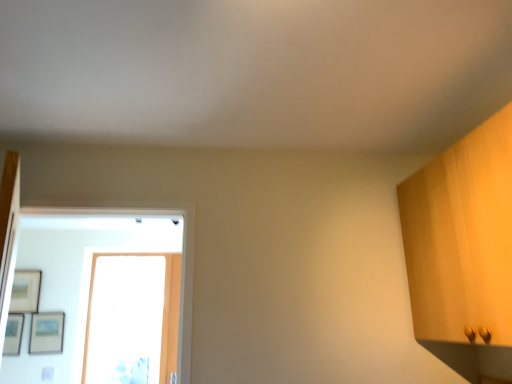
The height and width of the screenshot is (384, 512). What do you see at coordinates (25, 291) in the screenshot?
I see `matte wooden picture frame at upper left, arranged as the 1th picture frame when viewed from the left` at bounding box center [25, 291].

Image resolution: width=512 pixels, height=384 pixels. What are the coordinates of `transparent glass door at center` in the screenshot? It's located at (132, 319).

Where is `matte wooden picture frame at upper left, arranged as the 1th picture frame when viewed from the left`? This screenshot has height=384, width=512. matte wooden picture frame at upper left, arranged as the 1th picture frame when viewed from the left is located at coordinates (25, 291).

Between matte black picture frame at lower left, the first picture frame when ordered from right to left, and matte black picture frame at left, which is counted as the 2th picture frame, starting from the right, which one has more height?

Standing taller between the two is matte black picture frame at lower left, the first picture frame when ordered from right to left.

Consider the image. Is matte black picture frame at lower left, the first picture frame when ordered from right to left, aimed at matte black picture frame at left, which is counted as the 2th picture frame, starting from the right?

No, matte black picture frame at lower left, the first picture frame when ordered from right to left, does not turn towards matte black picture frame at left, which is counted as the 2th picture frame, starting from the right.

Considering the sizes of objects matte black picture frame at lower left, the first picture frame when ordered from right to left, and matte black picture frame at left, which is counted as the 2th picture frame, starting from the right, in the image provided, who is bigger, matte black picture frame at lower left, the first picture frame when ordered from right to left, or matte black picture frame at left, which is counted as the 2th picture frame, starting from the right,?

matte black picture frame at lower left, the first picture frame when ordered from right to left, is bigger.

Relative to matte black picture frame at left, marked as the second picture frame in a left-to-right arrangement, is matte black picture frame at lower left, the first picture frame when ordered from right to left, in front or behind?

matte black picture frame at lower left, the first picture frame when ordered from right to left, is behind matte black picture frame at left, marked as the second picture frame in a left-to-right arrangement.

Image resolution: width=512 pixels, height=384 pixels. Identify the location of glass door above the matte black picture frame at lower left, marked as the 3th picture frame in a left-to-right arrangement (from a real-world perspective). (132, 319).

How many degrees apart are the facing directions of matte black picture frame at lower left, marked as the 3th picture frame in a left-to-right arrangement, and transparent glass door at center?

There is a 0.17-degree angle between the facing directions of matte black picture frame at lower left, marked as the 3th picture frame in a left-to-right arrangement, and transparent glass door at center.

From the image's perspective, is matte black picture frame at lower left, the first picture frame when ordered from right to left, located above or below transparent glass door at center?

matte black picture frame at lower left, the first picture frame when ordered from right to left, is situated lower than transparent glass door at center in the image.

In terms of size, does matte wooden picture frame at upper left, arranged as the 1th picture frame when viewed from the left, appear bigger or smaller than matte black picture frame at left, marked as the second picture frame in a left-to-right arrangement?

In the image, matte wooden picture frame at upper left, arranged as the 1th picture frame when viewed from the left, appears to be larger than matte black picture frame at left, marked as the second picture frame in a left-to-right arrangement.

Between matte wooden picture frame at upper left, arranged as the 1th picture frame when viewed from the left, and matte black picture frame at left, marked as the second picture frame in a left-to-right arrangement, which one has more height?

matte wooden picture frame at upper left, arranged as the 1th picture frame when viewed from the left, is taller.

From a real-world perspective, between matte wooden picture frame at upper left, which is counted as the third picture frame, starting from the right, and matte black picture frame at left, marked as the second picture frame in a left-to-right arrangement, who is vertically lower?

matte black picture frame at left, marked as the second picture frame in a left-to-right arrangement.

How different are the orientations of matte wooden picture frame at upper left, arranged as the 1th picture frame when viewed from the left, and matte black picture frame at left, which is counted as the 2th picture frame, starting from the right, in degrees?

The angular difference between matte wooden picture frame at upper left, arranged as the 1th picture frame when viewed from the left, and matte black picture frame at left, which is counted as the 2th picture frame, starting from the right, is 0.13 degrees.

Are transparent glass door at center and matte wooden picture frame at upper left, which is counted as the third picture frame, starting from the right, located far from each other?

No, there isn't a large distance between transparent glass door at center and matte wooden picture frame at upper left, which is counted as the third picture frame, starting from the right.

From a real-world perspective, between transparent glass door at center and matte wooden picture frame at upper left, arranged as the 1th picture frame when viewed from the left, who is vertically higher?

matte wooden picture frame at upper left, arranged as the 1th picture frame when viewed from the left, is physically above.

Which is in front, point (174, 274) or point (40, 283)?

The point (174, 274) is in front.

Is transparent glass door at center bigger than matte black picture frame at left, marked as the second picture frame in a left-to-right arrangement?

Correct, transparent glass door at center is larger in size than matte black picture frame at left, marked as the second picture frame in a left-to-right arrangement.

Considering the relative sizes of transparent glass door at center and matte black picture frame at left, which is counted as the 2th picture frame, starting from the right, in the image provided, is transparent glass door at center thinner than matte black picture frame at left, which is counted as the 2th picture frame, starting from the right,?

In fact, transparent glass door at center might be wider than matte black picture frame at left, which is counted as the 2th picture frame, starting from the right.

The width and height of the screenshot is (512, 384). In order to click on the 2nd picture frame to the left of the transparent glass door at center, counting from the anchor's position in this screenshot , I will do `click(13, 334)`.

Is transparent glass door at center taller than matte black picture frame at left, which is counted as the 2th picture frame, starting from the right?

Yes, transparent glass door at center is taller than matte black picture frame at left, which is counted as the 2th picture frame, starting from the right.

Considering the points (20, 296) and (33, 337), which point is in front, point (20, 296) or point (33, 337)?

The point (33, 337) is in front.

From the picture: Is matte wooden picture frame at upper left, arranged as the 1th picture frame when viewed from the left, not near matte black picture frame at lower left, the first picture frame when ordered from right to left?

That's not correct — matte wooden picture frame at upper left, arranged as the 1th picture frame when viewed from the left, is a little close to matte black picture frame at lower left, the first picture frame when ordered from right to left.

From the picture: Which of these two, matte wooden picture frame at upper left, which is counted as the third picture frame, starting from the right, or matte black picture frame at lower left, the first picture frame when ordered from right to left, is bigger?

matte wooden picture frame at upper left, which is counted as the third picture frame, starting from the right, is bigger.

From a real-world perspective, is matte wooden picture frame at upper left, which is counted as the third picture frame, starting from the right, beneath matte black picture frame at lower left, the first picture frame when ordered from right to left?

No, from a real-world perspective, matte wooden picture frame at upper left, which is counted as the third picture frame, starting from the right, is not below matte black picture frame at lower left, the first picture frame when ordered from right to left.

Considering the relative positions of matte black picture frame at left, which is counted as the 2th picture frame, starting from the right, and matte wooden picture frame at upper left, which is counted as the third picture frame, starting from the right, in the image provided, is matte black picture frame at left, which is counted as the 2th picture frame, starting from the right, in front of matte wooden picture frame at upper left, which is counted as the third picture frame, starting from the right,?

Yes, the depth of matte black picture frame at left, which is counted as the 2th picture frame, starting from the right, is less than that of matte wooden picture frame at upper left, which is counted as the third picture frame, starting from the right.

Can you confirm if matte black picture frame at left, marked as the second picture frame in a left-to-right arrangement, is thinner than matte wooden picture frame at upper left, which is counted as the third picture frame, starting from the right?

Indeed, matte black picture frame at left, marked as the second picture frame in a left-to-right arrangement, has a lesser width compared to matte wooden picture frame at upper left, which is counted as the third picture frame, starting from the right.

Which is closer to the camera, (x=21, y=319) or (x=38, y=276)?

Clearly, point (x=21, y=319) is closer to the camera than point (x=38, y=276).

What are the coordinates of `picture frame in front of the matte black picture frame at lower left, marked as the 3th picture frame in a left-to-right arrangement` in the screenshot? It's located at (13, 334).

From the image's perspective, starting from the transparent glass door at center, which picture frame is the 1st one below? Please provide its 2D coordinates.

[(47, 333)]

Estimate the real-world distances between objects in this image. Which object is closer to matte black picture frame at left, marked as the second picture frame in a left-to-right arrangement, matte wooden picture frame at upper left, which is counted as the third picture frame, starting from the right, or transparent glass door at center?

Based on the image, matte wooden picture frame at upper left, which is counted as the third picture frame, starting from the right, appears to be nearer to matte black picture frame at left, marked as the second picture frame in a left-to-right arrangement.

Based on their spatial positions, is transparent glass door at center or matte black picture frame at left, which is counted as the 2th picture frame, starting from the right, further from matte black picture frame at lower left, marked as the 3th picture frame in a left-to-right arrangement?

transparent glass door at center is positioned further to the anchor matte black picture frame at lower left, marked as the 3th picture frame in a left-to-right arrangement.

Considering their positions, is matte black picture frame at left, which is counted as the 2th picture frame, starting from the right, positioned closer to matte wooden picture frame at upper left, which is counted as the third picture frame, starting from the right, than transparent glass door at center?

matte black picture frame at left, which is counted as the 2th picture frame, starting from the right, lies closer to matte wooden picture frame at upper left, which is counted as the third picture frame, starting from the right, than the other object.

Looking at the image, which one is located closer to matte wooden picture frame at upper left, arranged as the 1th picture frame when viewed from the left, matte black picture frame at left, which is counted as the 2th picture frame, starting from the right, or matte black picture frame at lower left, the first picture frame when ordered from right to left?

matte black picture frame at left, which is counted as the 2th picture frame, starting from the right.

When comparing their distances from matte black picture frame at left, marked as the second picture frame in a left-to-right arrangement, does matte black picture frame at lower left, the first picture frame when ordered from right to left, or transparent glass door at center seem further?

transparent glass door at center is positioned further to the anchor matte black picture frame at left, marked as the second picture frame in a left-to-right arrangement.

Looking at the image, which one is located further to matte black picture frame at left, marked as the second picture frame in a left-to-right arrangement, transparent glass door at center or matte black picture frame at lower left, the first picture frame when ordered from right to left?

transparent glass door at center is positioned further to the anchor matte black picture frame at left, marked as the second picture frame in a left-to-right arrangement.

Based on their spatial positions, is matte black picture frame at lower left, marked as the 3th picture frame in a left-to-right arrangement, or matte black picture frame at left, marked as the second picture frame in a left-to-right arrangement, closer to matte wooden picture frame at upper left, arranged as the 1th picture frame when viewed from the left?

matte black picture frame at left, marked as the second picture frame in a left-to-right arrangement, is closer to matte wooden picture frame at upper left, arranged as the 1th picture frame when viewed from the left.

From the image, which object appears to be nearer to matte wooden picture frame at upper left, which is counted as the third picture frame, starting from the right, transparent glass door at center or matte black picture frame at lower left, marked as the 3th picture frame in a left-to-right arrangement?

matte black picture frame at lower left, marked as the 3th picture frame in a left-to-right arrangement, is positioned closer to the anchor matte wooden picture frame at upper left, which is counted as the third picture frame, starting from the right.

Locate an element on the screen. This screenshot has height=384, width=512. picture frame between matte black picture frame at left, marked as the second picture frame in a left-to-right arrangement, and transparent glass door at center from left to right is located at coordinates (47, 333).

Locate an element on the screen. The image size is (512, 384). picture frame between matte wooden picture frame at upper left, which is counted as the third picture frame, starting from the right, and matte black picture frame at left, which is counted as the 2th picture frame, starting from the right, vertically is located at coordinates (47, 333).